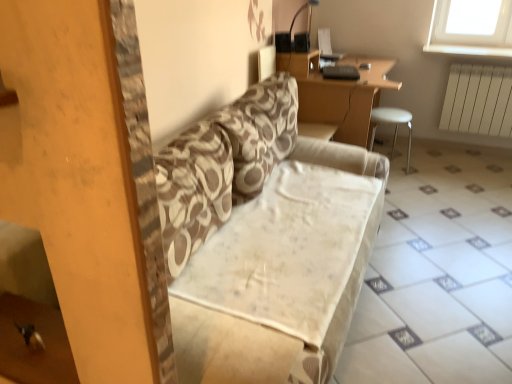
Question: Can you see white plastic radiator at right touching wooden desk at upper center?

Choices:
 (A) yes
 (B) no

Answer: (B)

Question: Does white plastic radiator at right have a smaller size compared to wooden desk at upper center?

Choices:
 (A) yes
 (B) no

Answer: (A)

Question: Is white plastic radiator at right closer to camera compared to wooden desk at upper center?

Choices:
 (A) no
 (B) yes

Answer: (A)

Question: Considering the relative positions of white plastic radiator at right and wooden desk at upper center in the image provided, is white plastic radiator at right to the left of wooden desk at upper center from the viewer's perspective?

Choices:
 (A) yes
 (B) no

Answer: (B)

Question: Could you tell me if white plastic radiator at right is facing wooden desk at upper center?

Choices:
 (A) yes
 (B) no

Answer: (B)

Question: Is white plastic radiator at right oriented away from wooden desk at upper center?

Choices:
 (A) no
 (B) yes

Answer: (A)

Question: Is wooden desk at upper center not near white plastic radiator at right?

Choices:
 (A) no
 (B) yes

Answer: (B)

Question: Can you confirm if wooden desk at upper center is bigger than white plastic radiator at right?

Choices:
 (A) no
 (B) yes

Answer: (B)

Question: Does wooden desk at upper center have a greater height compared to white plastic radiator at right?

Choices:
 (A) no
 (B) yes

Answer: (B)

Question: Could you tell me if wooden desk at upper center is facing white plastic radiator at right?

Choices:
 (A) no
 (B) yes

Answer: (B)

Question: Is wooden desk at upper center looking in the opposite direction of white plastic radiator at right?

Choices:
 (A) no
 (B) yes

Answer: (A)

Question: Does wooden desk at upper center appear on the left side of white plastic radiator at right?

Choices:
 (A) yes
 (B) no

Answer: (A)

Question: Can you confirm if wooden desk at upper center is taller than patterned fabric couch at center?

Choices:
 (A) yes
 (B) no

Answer: (A)